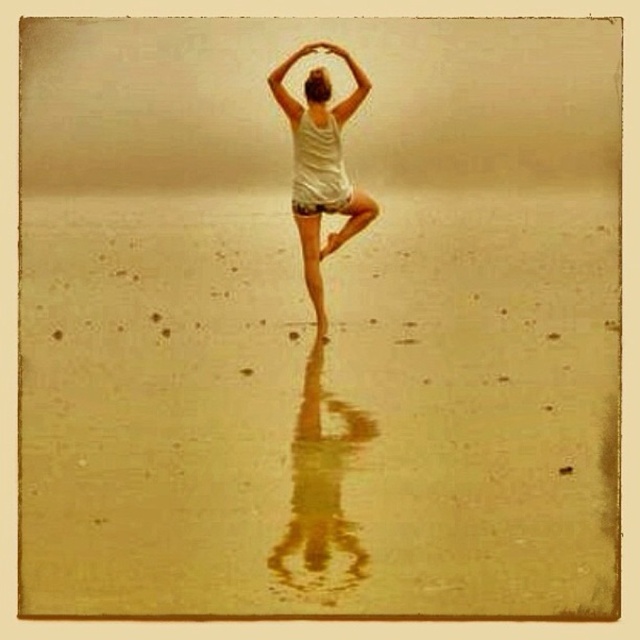
Question: Which point appears closest to the camera in this image?

Choices:
 (A) (337, 243)
 (B) (324, 90)

Answer: (B)

Question: Observing the image, what is the correct spatial positioning of white cotton tank top at center in reference to smooth blonde hair at upper center?

Choices:
 (A) below
 (B) above

Answer: (A)

Question: Is smooth golden sand at center closer to the viewer compared to white cotton tank top at center?

Choices:
 (A) yes
 (B) no

Answer: (A)

Question: Which of the following is the closest to the observer?

Choices:
 (A) [321, 86]
 (B) [365, 218]

Answer: (A)

Question: Which object is the farthest from the smooth golden sand at center?

Choices:
 (A) white cotton tank top at center
 (B) smooth blonde hair at upper center

Answer: (B)

Question: Observing the image, what is the correct spatial positioning of smooth golden sand at center in reference to smooth blonde hair at upper center?

Choices:
 (A) right
 (B) left

Answer: (B)